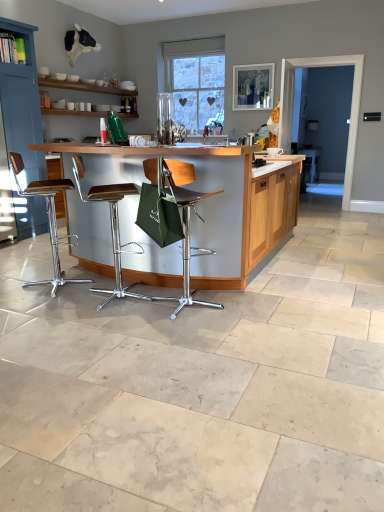
Find the location of a particular element. Image resolution: width=384 pixels, height=512 pixels. vacant space to the right of green fabric chair at center, the first chair positioned from the right is located at coordinates (247, 308).